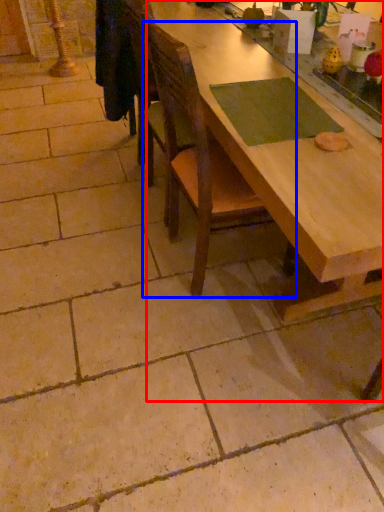
Question: Which object is closer to the camera taking this photo, table (highlighted by a red box) or chair (highlighted by a blue box)?

Choices:
 (A) table
 (B) chair

Answer: (A)